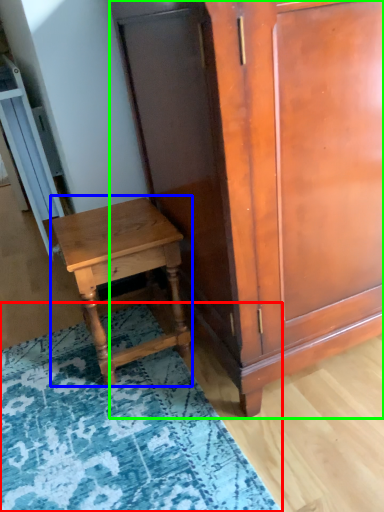
Question: Which object is positioned closest to mat (highlighted by a red box)? Select from nightstand (highlighted by a blue box) and cabinetry (highlighted by a green box).

Choices:
 (A) nightstand
 (B) cabinetry

Answer: (A)